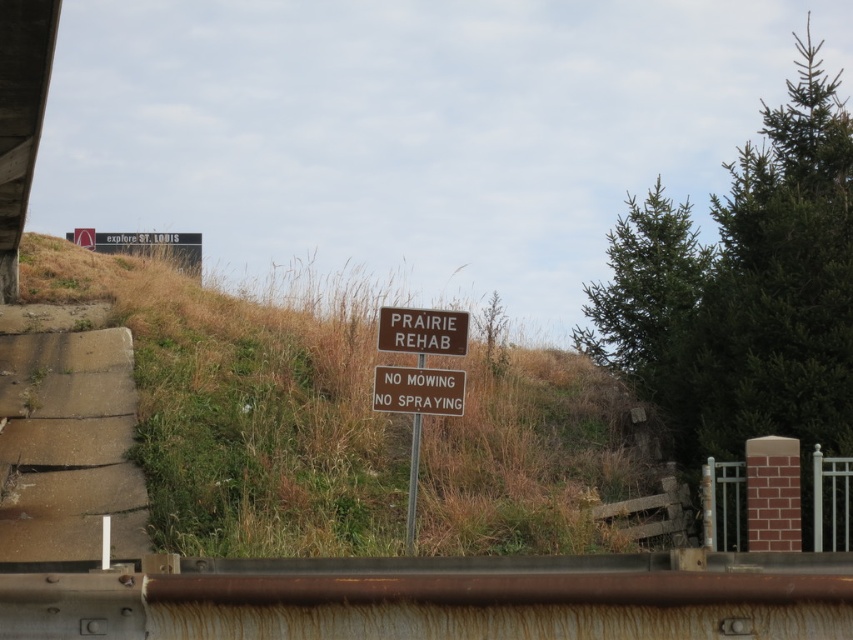
Looking at this image, between concrete at left and brown metal sign at center, which one has less height?

Standing shorter between the two is brown metal sign at center.

Does concrete at left have a greater width compared to brown metal sign at center?

Yes, concrete at left is wider than brown metal sign at center.

Is point (3, 68) positioned before point (451, 390)?

Yes.

This screenshot has height=640, width=853. Identify the location of concrete at left. (20, 116).

Is brown grass at center closer to the viewer compared to brown wooden sign at center?

Yes, it is in front of brown wooden sign at center.

At what (x,y) coordinates should I click in order to perform the action: click on brown grass at center. Please return your answer as a coordinate pair (x, y). The height and width of the screenshot is (640, 853). Looking at the image, I should click on coord(244,412).

Does brown grass at center have a greater width compared to brown metal sign at center?

Yes, brown grass at center is wider than brown metal sign at center.

Can you confirm if brown grass at center is positioned to the left of brown metal sign at center?

Yes, brown grass at center is to the left of brown metal sign at center.

Is point (438, 426) farther from viewer compared to point (396, 403)?

Yes, point (438, 426) is behind point (396, 403).

The width and height of the screenshot is (853, 640). In order to click on brown grass at center in this screenshot , I will do `click(244, 412)`.